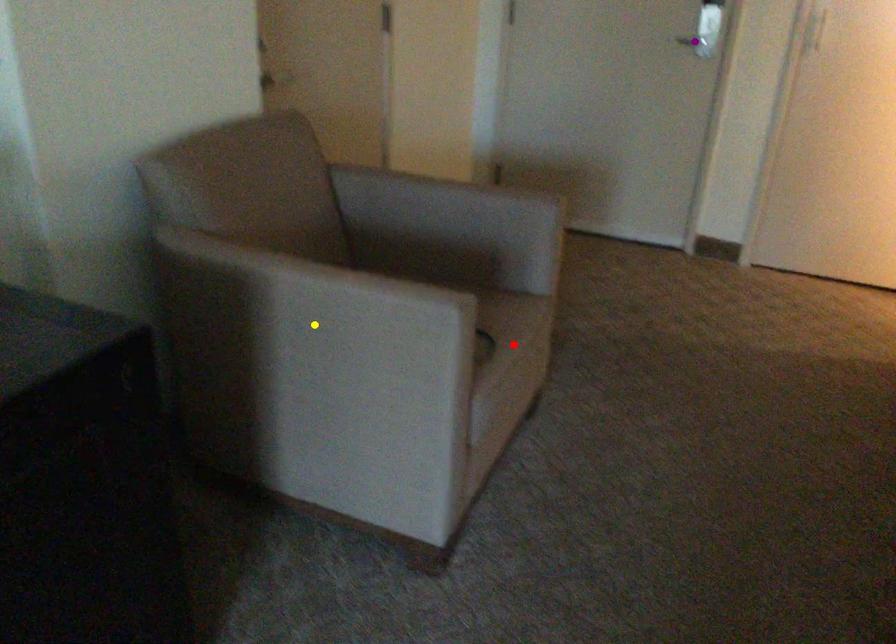
Order these from nearest to farthest:
1. purple point
2. yellow point
3. red point

yellow point < red point < purple point